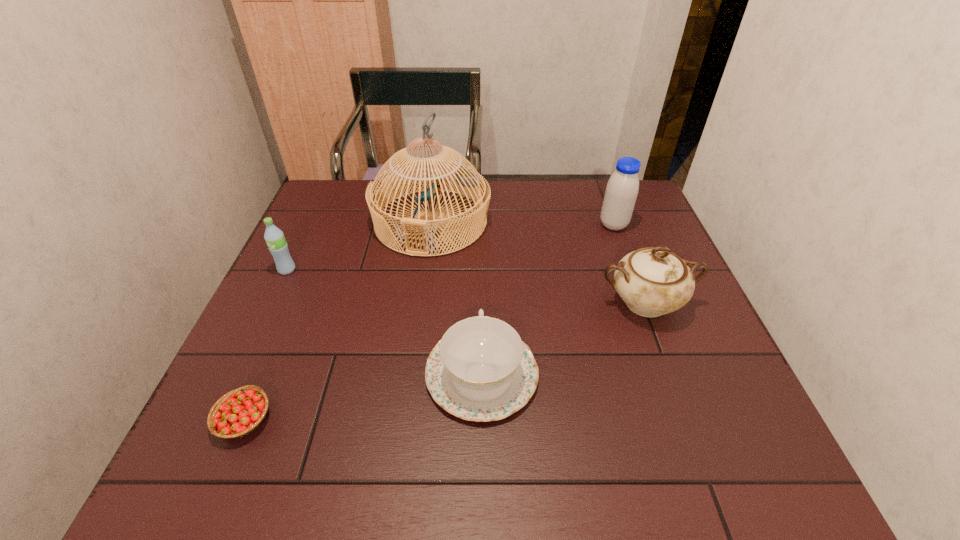
Identify the location of the tallest object. The image size is (960, 540). (466, 178).

You are a GUI agent. You are given a task and a screenshot of the screen. Output one action in this format:
    pyautogui.click(x=<x>, y=<y>)
    Task: Click on the soya milk
    
    Given the screenshot: What is the action you would take?
    pyautogui.click(x=622, y=188)

Locate an element on the screen. the third nearest object is located at coordinates (652, 282).

Find the location of `the farther chinaware`. the farther chinaware is located at coordinates (652, 282).

Identify the location of the third farthest object. The height and width of the screenshot is (540, 960). (274, 237).

Where is `the left chinaware`? the left chinaware is located at coordinates (481, 370).

Find the location of `the shorter chinaware`. the shorter chinaware is located at coordinates 481,370.

Locate an element on the screen. Image resolution: width=960 pixels, height=540 pixels. strawberry is located at coordinates (239, 412).

Identify the location of free space located 0.110m on the left of the tallest object. (335, 222).

Find the location of a particular element. The image size is (960, 540). vacant area situated 0.130m on the back of the soya milk is located at coordinates (602, 193).